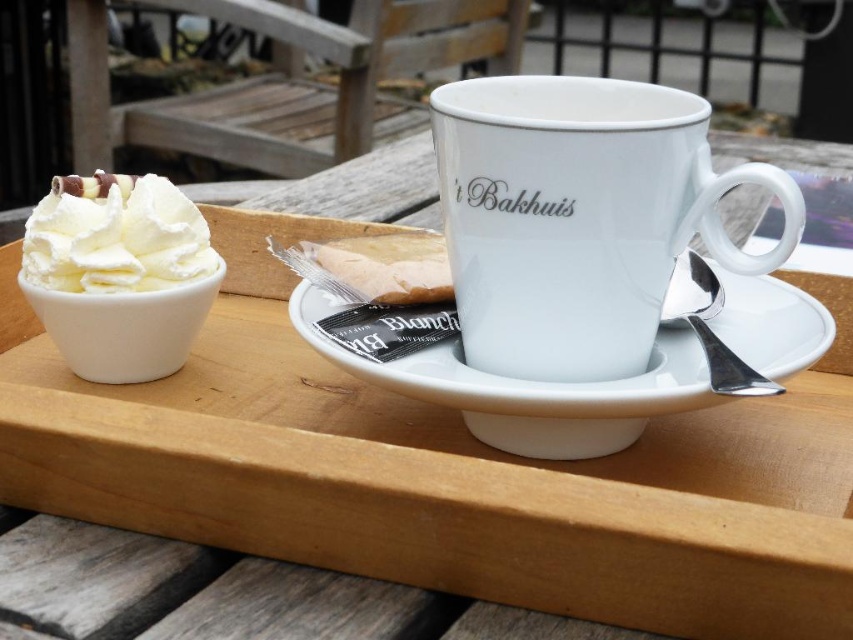
You are setting up a table for a tea party and need to place a small vase between the white porcelain mug at center and the whipped cream at left. Which side of the mug should you place the vase so it doesn

The white porcelain mug at center is wider than the whipped cream at left, so placing the vase to the left of the mug would ensure there is enough space between them.

You are setting up a tea service and need to place a teapot between the white porcelain mug at center and the white ceramic plate at center. Based on their positions, which object should the teapot be closer to?

The white ceramic plate at center is behind the white porcelain mug at center, so the teapot should be placed closer to the white porcelain mug at center to maintain a natural flow between the two items.

You are setting up a table for a tea party and have a white porcelain mug at center and whipped cream at left. Which item is taller?

The white porcelain mug at center is much taller than the whipped cream at left.